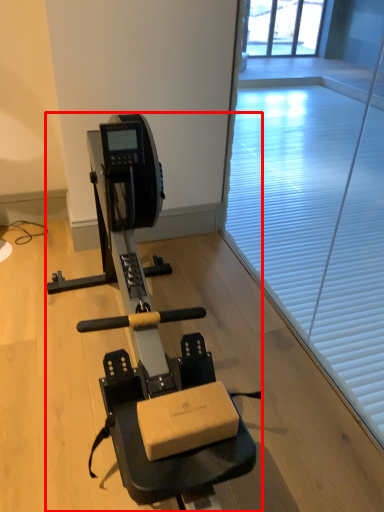
Question: From the image's perspective, considering the relative positions of stationary bicycle (annotated by the red box) and window screen in the image provided, where is stationary bicycle (annotated by the red box) located with respect to the staircase?

Choices:
 (A) below
 (B) above

Answer: (A)